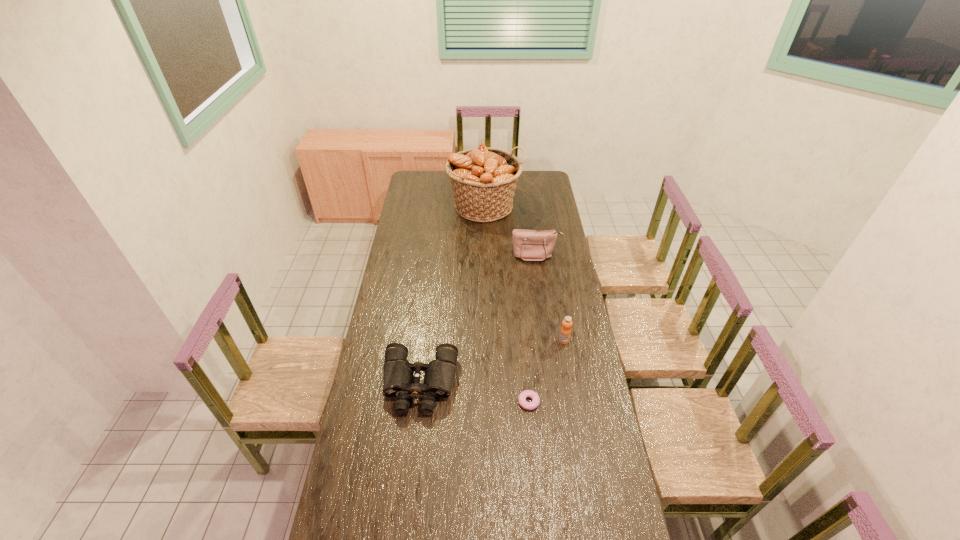
Identify the location of the tallest object. (483, 179).

The image size is (960, 540). Find the location of `basket`. basket is located at coordinates (483, 179).

I want to click on the fourth nearest object, so click(529, 245).

This screenshot has height=540, width=960. Find the location of `the third farthest object`. the third farthest object is located at coordinates (565, 332).

Where is `binoculars`? This screenshot has width=960, height=540. binoculars is located at coordinates (398, 373).

Find the location of a particular element. This screenshot has height=540, width=960. doughnut is located at coordinates (523, 395).

Locate an element on the screen. Image resolution: width=960 pixels, height=540 pixels. free location located on the left of the basket is located at coordinates (433, 206).

Where is `free region located on the front pocket of the shoulder bag`? The height and width of the screenshot is (540, 960). free region located on the front pocket of the shoulder bag is located at coordinates (544, 316).

The width and height of the screenshot is (960, 540). Identify the location of vacant space located on the front label of the third farthest object. (576, 410).

This screenshot has width=960, height=540. Identify the location of vacant space located through the eyepieces of the fourth tallest object. (412, 456).